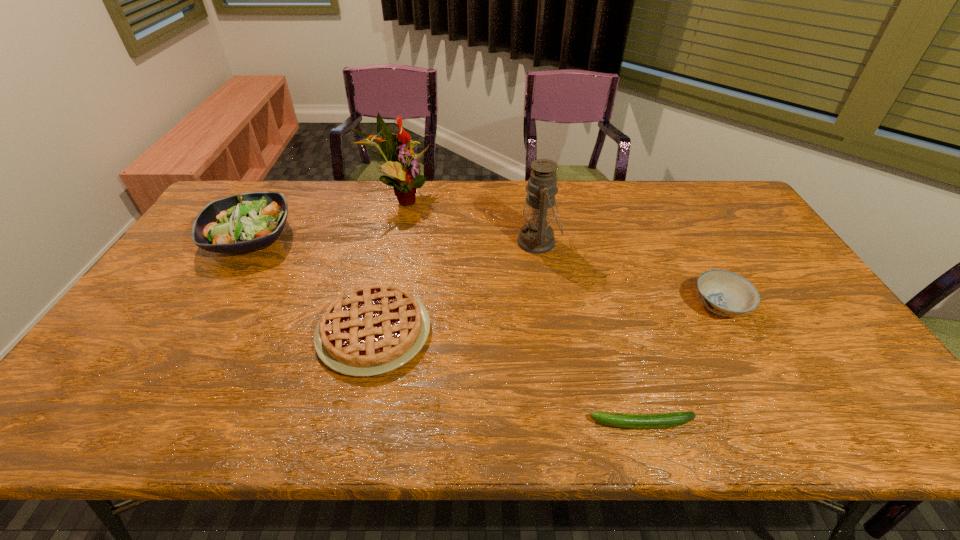
Identify the location of vacant point located on the front of the leftmost object. (187, 341).

In order to click on vacant area located on the front of the rightmost object in this screenshot , I will do `click(780, 416)`.

At what (x,y) coordinates should I click in order to perform the action: click on vacant space positioned on the right of the pie. Please return your answer as a coordinate pair (x, y). The width and height of the screenshot is (960, 540). Looking at the image, I should click on (466, 332).

Locate an element on the screen. This screenshot has height=540, width=960. vacant space located 0.360m on the front-facing side of the shortest object is located at coordinates (421, 423).

You are a GUI agent. You are given a task and a screenshot of the screen. Output one action in this format:
    pyautogui.click(x=<x>, y=<y>)
    Task: Click on the vacant space located on the front-facing side of the shortest object
    
    Given the screenshot: What is the action you would take?
    pyautogui.click(x=473, y=423)

This screenshot has width=960, height=540. What are the coordinates of `vacant space located on the front-facing side of the shortest object` in the screenshot? It's located at (421, 423).

This screenshot has height=540, width=960. Find the location of `bouquet that is at the far edge`. bouquet that is at the far edge is located at coordinates coord(407,178).

Image resolution: width=960 pixels, height=540 pixels. Find the location of `salad plate that is at the far edge`. salad plate that is at the far edge is located at coordinates (243, 222).

Find the location of a particular element. The image size is (960, 540). object present at the near edge is located at coordinates (635, 421).

This screenshot has width=960, height=540. Find the location of `object that is at the left edge`. object that is at the left edge is located at coordinates (243, 222).